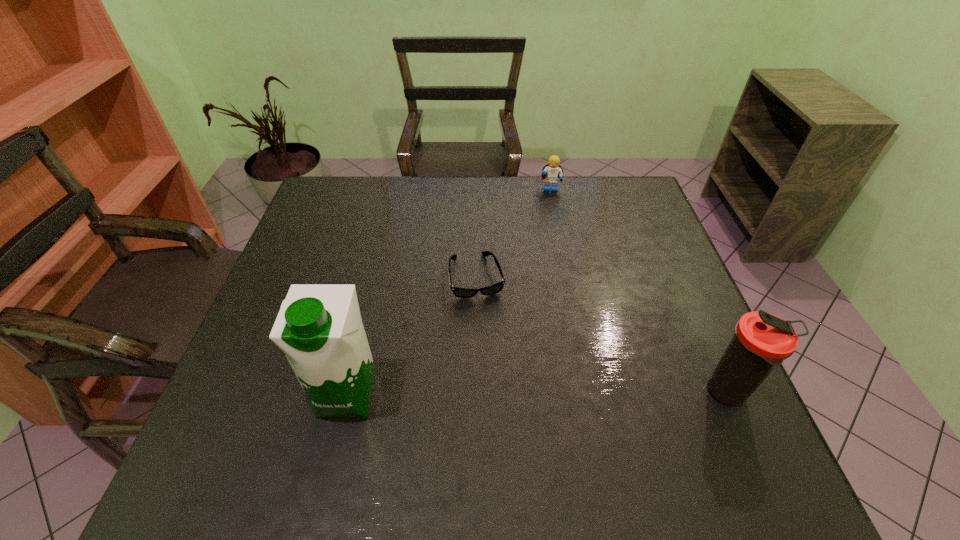
I want to click on empty space that is in between the second tallest object and the second object from right to left, so click(639, 292).

Identify the location of free space between the leftmost object and the second object from left to right. (412, 335).

This screenshot has height=540, width=960. What are the coordinates of `free spot between the shortest object and the thermos bottle` in the screenshot? It's located at tap(603, 335).

I want to click on vacant space that is in between the tallest object and the second shortest object, so click(x=449, y=292).

You are a GUI agent. You are given a task and a screenshot of the screen. Output one action in this format:
    pyautogui.click(x=<x>, y=<y>)
    Task: Click on the free space between the rightmost object and the farthest object
    The width and height of the screenshot is (960, 540).
    Given the screenshot: What is the action you would take?
    pyautogui.click(x=639, y=292)

Point out which object is positioned as the second nearest to the Lego. Please provide its 2D coordinates. Your answer should be formatted as a tuple, i.e. [(x, y)], where the tuple contains the x and y coordinates of a point satisfying the conditions above.

[(762, 341)]

This screenshot has height=540, width=960. What are the coordinates of `object that is the third closest to the Lego` in the screenshot? It's located at (319, 328).